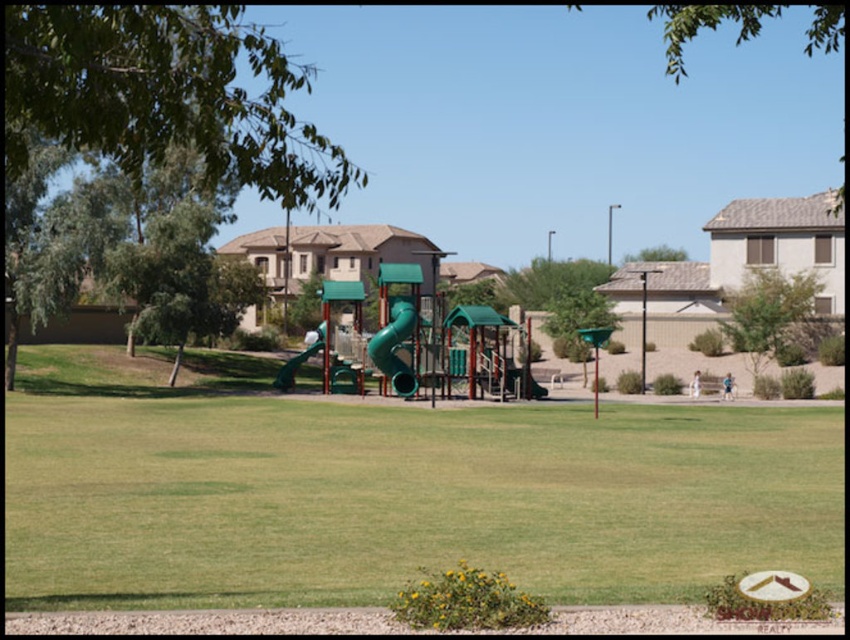
Question: Which object is the closest to the green matte slide at center?

Choices:
 (A) green grass at center
 (B) green rubber slide at center
 (C) light blue denim shorts at lower right
 (D) white fabric child at lower right

Answer: (B)

Question: Which object is positioned farthest from the white fabric child at lower right?

Choices:
 (A) green rubber slide at center
 (B) green grass at center
 (C) green matte slide at center

Answer: (B)

Question: Does green matte slide at center appear over light blue denim shorts at lower right?

Choices:
 (A) yes
 (B) no

Answer: (A)

Question: Is green matte slide at center smaller than white fabric child at lower right?

Choices:
 (A) yes
 (B) no

Answer: (B)

Question: Can you confirm if light blue denim shorts at lower right is positioned below white fabric child at lower right?

Choices:
 (A) no
 (B) yes

Answer: (B)

Question: Which point is farther to the camera?

Choices:
 (A) green grass at center
 (B) light blue denim shorts at lower right
 (C) green rubber slide at center

Answer: (C)